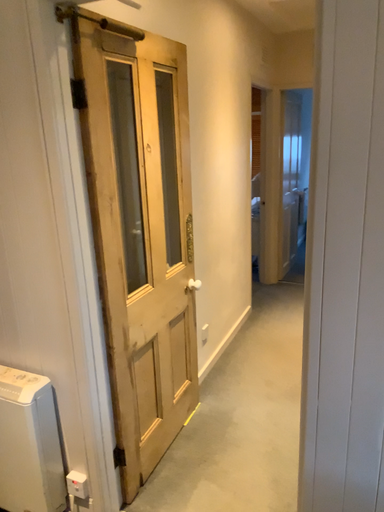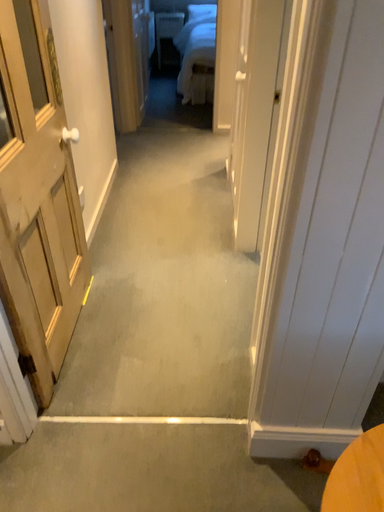
Question: How did the camera likely rotate when shooting the video?

Choices:
 (A) rotated downward
 (B) rotated upward

Answer: (A)